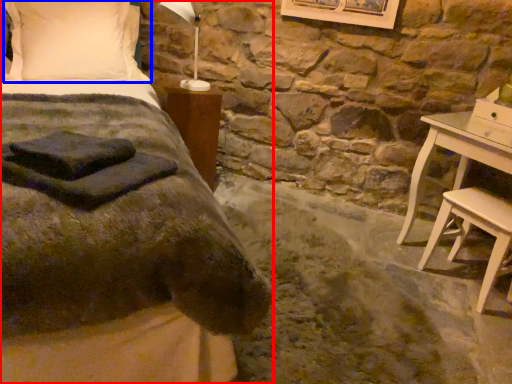
Question: Among these objects, which one is farthest to the camera, bed (highlighted by a red box) or pillow (highlighted by a blue box)?

Choices:
 (A) bed
 (B) pillow

Answer: (B)